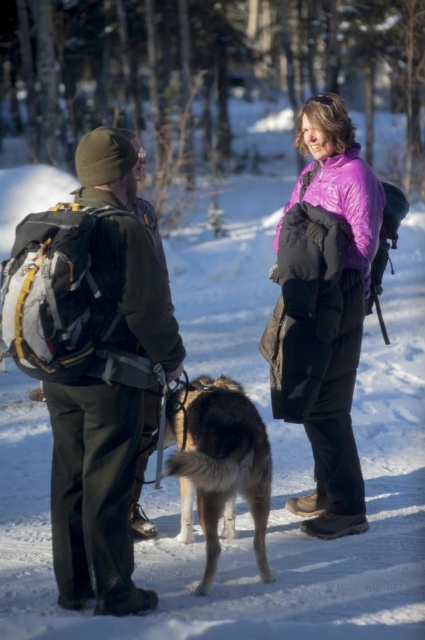
You are standing at point (380,202) and want to walk to point (311,200). Which direction should you move in to reach your destination?

You should move forward because point (311,200) is behind point (380,202), meaning it is in the direction you are facing as you walk away from your current position.

In the snowy forest scene, there are two people and a dog. You are standing at the center and see the purple fleece jacket at center and the fluffy brown dog at center. Which one is larger in size?

The purple fleece jacket at center is bigger than the fluffy brown dog at center.

You are standing in the snowy forest and see two people wearing jackets. The first person has a green fabric jacket at left and the second has a purple fleece jacket at center. Which jacket is positioned more to the east side of the scene?

The green fabric jacket at left is positioned more to the east side of the scene because it is to the left of the purple fleece jacket at center, and in the scene, left typically corresponds to the east direction when facing the image.